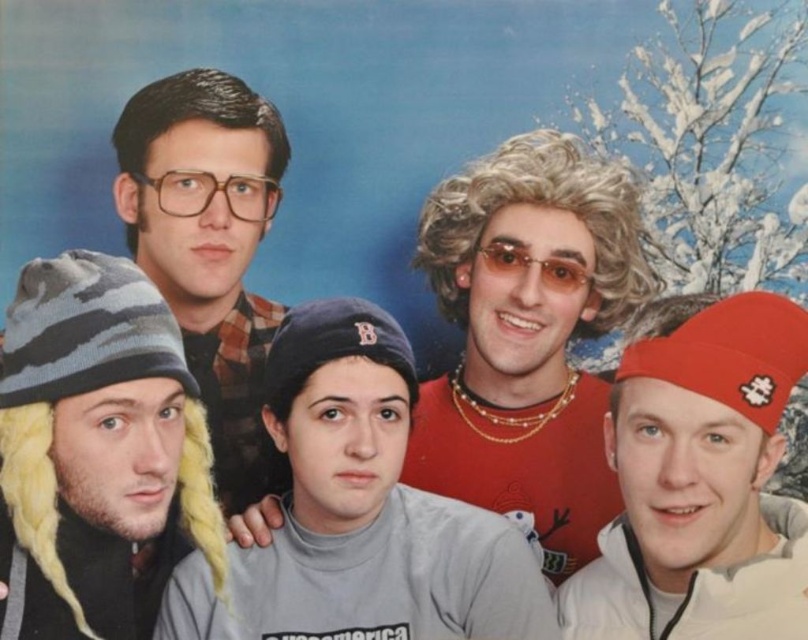
Question: Estimate the real-world distances between objects in this image. Which object is closer to the gray matte t-shirt at center?

Choices:
 (A) matte black glasses at upper left
 (B) red matte cap at lower right

Answer: (B)

Question: Which object appears closest to the camera in this image?

Choices:
 (A) gray matte t-shirt at center
 (B) shiny gold necklace at center

Answer: (A)

Question: Can you confirm if shiny gold necklace at center is positioned to the right of red matte cap at lower right?

Choices:
 (A) no
 (B) yes

Answer: (A)

Question: Which point is farther to the camera?

Choices:
 (A) gray matte t-shirt at center
 (B) red matte cap at lower right
 (C) matte black glasses at upper left

Answer: (C)

Question: Is gray matte t-shirt at center to the left of red matte cap at lower right from the viewer's perspective?

Choices:
 (A) yes
 (B) no

Answer: (A)

Question: Is the position of shiny gold necklace at center less distant than that of red matte cap at lower right?

Choices:
 (A) yes
 (B) no

Answer: (B)